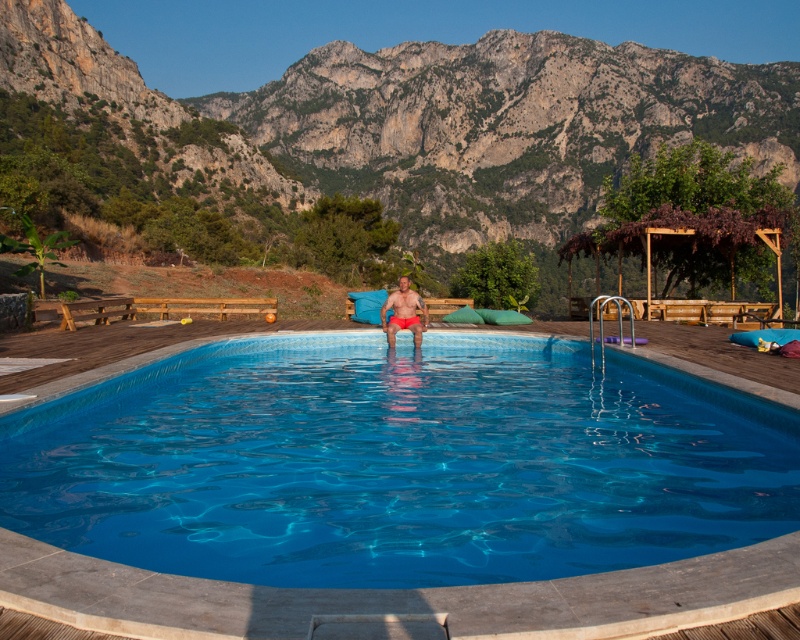
Question: Which object is farther from the camera taking this photo?

Choices:
 (A) matte red shorts at center
 (B) rocky cliff at upper center
 (C) blue glossy pool at center

Answer: (B)

Question: Is rocky cliff at upper center above matte red shorts at center?

Choices:
 (A) no
 (B) yes

Answer: (B)

Question: Can you confirm if blue glossy pool at center is positioned to the right of rocky cliff at upper center?

Choices:
 (A) yes
 (B) no

Answer: (A)

Question: Is blue glossy pool at center smaller than rocky cliff at upper center?

Choices:
 (A) yes
 (B) no

Answer: (A)

Question: Which point is closer to the camera?

Choices:
 (A) (385, 308)
 (B) (52, 541)

Answer: (B)

Question: Which point is farther from the camera taking this photo?

Choices:
 (A) (244, 413)
 (B) (173, 179)
 (C) (406, 304)

Answer: (B)